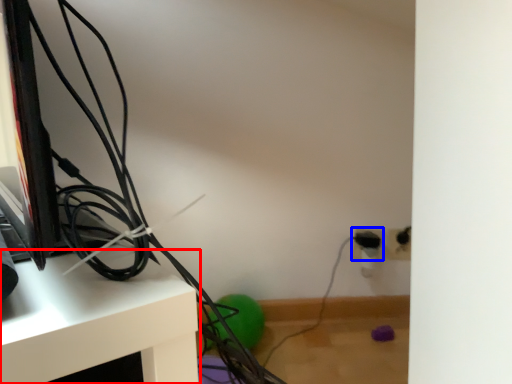
Question: Which object appears farthest to the camera in this image, furniture (highlighted by a red box) or electric outlet (highlighted by a blue box)?

Choices:
 (A) furniture
 (B) electric outlet

Answer: (B)